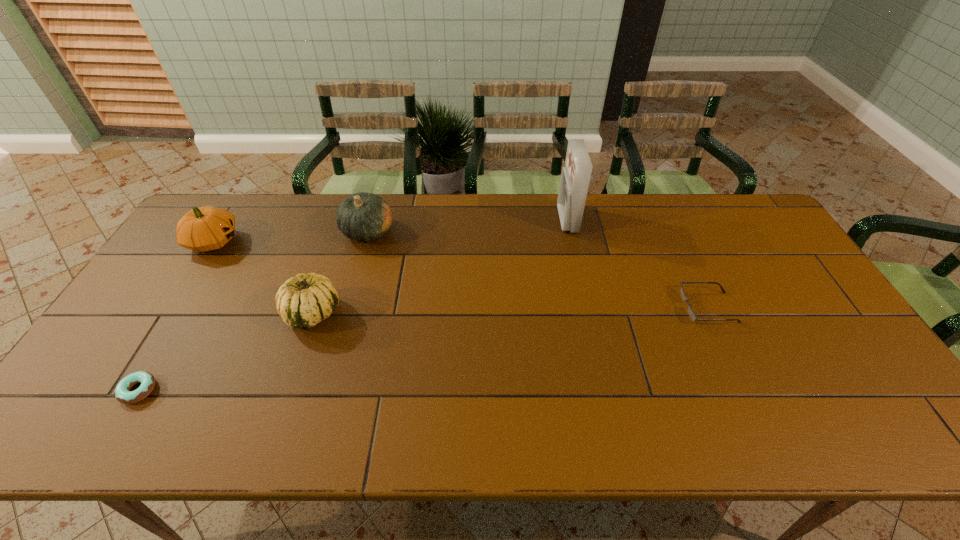
You are a GUI agent. You are given a task and a screenshot of the screen. Output one action in this format:
    pyautogui.click(x=<x>, y=<y>)
    Task: Click on the object situated at the far left corner
    
    Given the screenshot: What is the action you would take?
    pyautogui.click(x=202, y=229)

Identify the location of vacant space at the far edge of the desktop. The image size is (960, 540). (623, 225).

The width and height of the screenshot is (960, 540). Find the location of `blank area at the near edge`. blank area at the near edge is located at coordinates coord(639,441).

The width and height of the screenshot is (960, 540). In the image, there is a desktop. In order to click on blank space at the left edge in this screenshot , I will do `click(139, 349)`.

At what (x,y) coordinates should I click in order to perform the action: click on vacant area at the right edge. Please return your answer as a coordinate pair (x, y). Image resolution: width=960 pixels, height=540 pixels. Looking at the image, I should click on (743, 249).

This screenshot has height=540, width=960. In the image, there is a desktop. Identify the location of vacant space at the far left corner. (219, 203).

Image resolution: width=960 pixels, height=540 pixels. In order to click on empty space between the leftmost gourd and the rightmost object in this screenshot , I will do `click(461, 274)`.

The width and height of the screenshot is (960, 540). I want to click on unoccupied area between the leftmost gourd and the tallest object, so click(x=391, y=231).

You are a GUI agent. You are given a task and a screenshot of the screen. Output one action in this format:
    pyautogui.click(x=<x>, y=<y>)
    Task: Click on the empty space between the leftmost gourd and the rightmost object
    The image size is (960, 540).
    Given the screenshot: What is the action you would take?
    pyautogui.click(x=461, y=274)

Find the location of `unoccupied area between the nearest object and the leftmost gourd`. unoccupied area between the nearest object and the leftmost gourd is located at coordinates (176, 316).